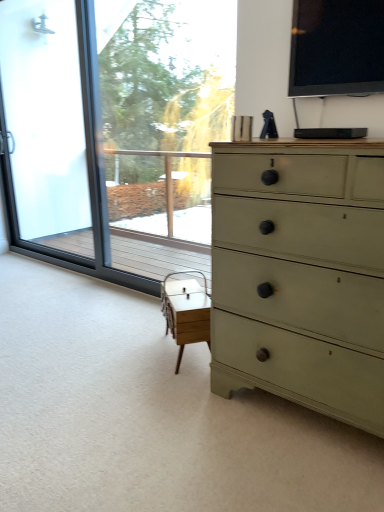
What are the coordinates of `frosted glass screen door at left` in the screenshot? It's located at (47, 119).

What is the approximate width of matte green dresser at right?

matte green dresser at right is 51.86 centimeters wide.

Measure the distance between transparent glass window at left, the 1th window screen from the back, and camera.

The distance of transparent glass window at left, the 1th window screen from the back, from camera is 4.20 meters.

Image resolution: width=384 pixels, height=512 pixels. What do you see at coordinates (163, 125) in the screenshot? I see `transparent glass window at left, the 1th window screen from the back` at bounding box center [163, 125].

Identify the location of frosted glass screen door at left. (47, 119).

From their relative heights in the image, would you say matte green dresser at right is taller or shorter than transparent glass window at left, the 1th window screen from the back?

Considering their sizes, matte green dresser at right has less height than transparent glass window at left, the 1th window screen from the back.

Is matte green dresser at right not close to transparent glass window at left, which appears as the 1th window screen when viewed from the left?

Yes, matte green dresser at right and transparent glass window at left, which appears as the 1th window screen when viewed from the left, are located far from each other.

Is matte green dresser at right looking in the opposite direction of transparent glass window at left, which is the 2th window screen in right-to-left order?

No, matte green dresser at right is not facing away from transparent glass window at left, which is the 2th window screen in right-to-left order.

In the scene shown: Is black glossy tv at upper right, acting as the 2th window screen starting from the left, taller than transparent glass window at left, which appears as the 1th window screen when viewed from the left?

No, black glossy tv at upper right, acting as the 2th window screen starting from the left, is not taller than transparent glass window at left, which appears as the 1th window screen when viewed from the left.

Based on their positions, is black glossy tv at upper right, acting as the 2th window screen starting from the left, located to the left or right of transparent glass window at left, which is the 2th window screen in right-to-left order?

From the image, it's evident that black glossy tv at upper right, acting as the 2th window screen starting from the left, is to the right of transparent glass window at left, which is the 2th window screen in right-to-left order.

Does black glossy tv at upper right, positioned as the second window screen in back-to-front order, come behind transparent glass window at left, the second window screen viewed from the front?

That is False.

Is the surface of black glossy tv at upper right, positioned as the second window screen in back-to-front order, in direct contact with transparent glass window at left, the second window screen viewed from the front?

There is a gap between black glossy tv at upper right, positioned as the second window screen in back-to-front order, and transparent glass window at left, the second window screen viewed from the front.

Is frosted glass screen door at left to the right of transparent glass window at left, which is the 2th window screen in right-to-left order, from the viewer's perspective?

Incorrect, frosted glass screen door at left is not on the right side of transparent glass window at left, which is the 2th window screen in right-to-left order.

Is frosted glass screen door at left facing away from transparent glass window at left, the second window screen viewed from the front?

No, frosted glass screen door at left is not facing the opposite direction of transparent glass window at left, the second window screen viewed from the front.

Is frosted glass screen door at left positioned behind transparent glass window at left, the second window screen viewed from the front?

Yes.

From a real-world perspective, which object stands above the other?

frosted glass screen door at left.

Does transparent glass window at left, which appears as the 1th window screen when viewed from the left, lie behind frosted glass screen door at left?

That is False.

Would you say transparent glass window at left, the 1th window screen from the back, is outside frosted glass screen door at left?

transparent glass window at left, the 1th window screen from the back, lies outside frosted glass screen door at left's area.

Is transparent glass window at left, which is the 2th window screen in right-to-left order, looking in the opposite direction of frosted glass screen door at left?

No, transparent glass window at left, which is the 2th window screen in right-to-left order, is not facing the opposite direction of frosted glass screen door at left.

Based on their sizes in the image, would you say black glossy tv at upper right, the first window screen positioned from the right, is bigger or smaller than white wood table at center?

In the image, black glossy tv at upper right, the first window screen positioned from the right, appears to be smaller than white wood table at center.

From the image's perspective, who appears lower, black glossy tv at upper right, positioned as the second window screen in back-to-front order, or white wood table at center?

white wood table at center.

From the image's perspective, which window screen is the 2nd one above the white wood table at center? Please provide its 2D coordinates.

[(336, 48)]

Are white wood table at center and transparent glass window at left, the 1th window screen from the back, located far from each other?

Indeed, white wood table at center is not near transparent glass window at left, the 1th window screen from the back.

From the image's perspective, is white wood table at center positioned above or below transparent glass window at left, the second window screen viewed from the front?

Based on their image positions, white wood table at center is located beneath transparent glass window at left, the second window screen viewed from the front.

Is white wood table at center outside of transparent glass window at left, which appears as the 1th window screen when viewed from the left?

white wood table at center is positioned outside transparent glass window at left, which appears as the 1th window screen when viewed from the left.

Is transparent glass window at left, which appears as the 1th window screen when viewed from the left, positioned before matte green dresser at right?

No, transparent glass window at left, which appears as the 1th window screen when viewed from the left, is further to the viewer.

How different are the orientations of transparent glass window at left, the second window screen viewed from the front, and matte green dresser at right in degrees?

They differ by 0.435 degrees in their facing directions.

The width and height of the screenshot is (384, 512). I want to click on the chest of drawers that is below the transparent glass window at left, which appears as the 1th window screen when viewed from the left (from the image's perspective), so click(x=300, y=274).

Where is `the chest of drawers below the transparent glass window at left, the 1th window screen from the back (from a real-world perspective)`? the chest of drawers below the transparent glass window at left, the 1th window screen from the back (from a real-world perspective) is located at coordinates (300, 274).

You are a GUI agent. You are given a task and a screenshot of the screen. Output one action in this format:
    pyautogui.click(x=<x>, y=<y>)
    Task: Click on the window screen above the transparent glass window at left, which is the 2th window screen in right-to-left order (from the image's perspective)
    
    Given the screenshot: What is the action you would take?
    pyautogui.click(x=336, y=48)

Estimate the real-world distances between objects in this image. Which object is further from frosted glass screen door at left, matte green dresser at right or transparent glass window at left, the 1th window screen from the back?

Among the two, matte green dresser at right is located further to frosted glass screen door at left.

Based on their spatial positions, is frosted glass screen door at left or matte green dresser at right closer to black glossy tv at upper right, positioned as the second window screen in back-to-front order?

matte green dresser at right is closer to black glossy tv at upper right, positioned as the second window screen in back-to-front order.

Looking at the image, which one is located closer to white wood table at center, matte green dresser at right or frosted glass screen door at left?

matte green dresser at right.

Looking at the image, which one is located closer to black glossy tv at upper right, the first window screen positioned from the right, transparent glass window at left, which appears as the 1th window screen when viewed from the left, or matte green dresser at right?

matte green dresser at right.

Based on the photo, from the image, which object appears to be nearer to transparent glass window at left, which is the 2th window screen in right-to-left order, frosted glass screen door at left or black glossy tv at upper right, the first window screen in the front-to-back sequence?

The object closer to transparent glass window at left, which is the 2th window screen in right-to-left order, is frosted glass screen door at left.

Looking at this image, which object lies nearer to the anchor point frosted glass screen door at left, white wood table at center or matte green dresser at right?

white wood table at center is closer to frosted glass screen door at left.

When comparing their distances from transparent glass window at left, which appears as the 1th window screen when viewed from the left, does matte green dresser at right or black glossy tv at upper right, acting as the 2th window screen starting from the left, seem closer?

black glossy tv at upper right, acting as the 2th window screen starting from the left.

From the picture: When comparing their distances from white wood table at center, does frosted glass screen door at left or black glossy tv at upper right, positioned as the second window screen in back-to-front order, seem further?

The object further to white wood table at center is frosted glass screen door at left.

This screenshot has width=384, height=512. Find the location of `table situated between frosted glass screen door at left and black glossy tv at upper right, acting as the 2th window screen starting from the left, from left to right`. table situated between frosted glass screen door at left and black glossy tv at upper right, acting as the 2th window screen starting from the left, from left to right is located at coordinates (187, 320).

Locate an element on the screen. the chest of drawers that lies between transparent glass window at left, the 1th window screen from the back, and white wood table at center from top to bottom is located at coordinates (300, 274).

Where is `chest of drawers between frosted glass screen door at left and black glossy tv at upper right, the first window screen in the front-to-back sequence, from left to right`? chest of drawers between frosted glass screen door at left and black glossy tv at upper right, the first window screen in the front-to-back sequence, from left to right is located at coordinates (300, 274).

Locate an element on the screen. This screenshot has height=512, width=384. chest of drawers between black glossy tv at upper right, acting as the 2th window screen starting from the left, and white wood table at center in the up-down direction is located at coordinates (300, 274).